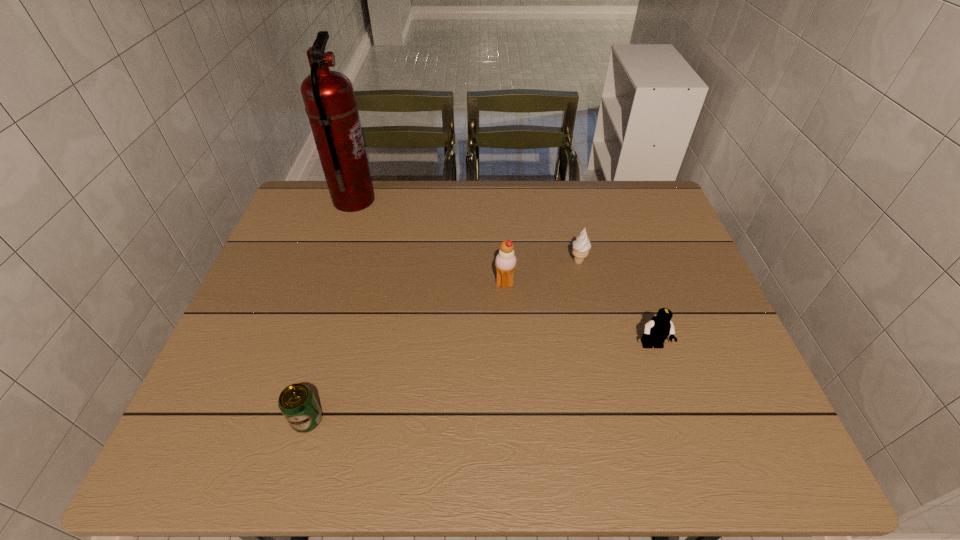
Identify the location of free space located on the nozzle side of the farthest object. This screenshot has width=960, height=540. (438, 201).

You are a GUI agent. You are given a task and a screenshot of the screen. Output one action in this format:
    pyautogui.click(x=<x>, y=<y>)
    Task: Click on the free space located at the front with a straw on the nearer icecream
    This screenshot has height=540, width=960.
    Given the screenshot: What is the action you would take?
    pyautogui.click(x=475, y=285)

Image resolution: width=960 pixels, height=540 pixels. What are the coordinates of `free spot located 0.280m at the front with a straw on the nearer icecream` in the screenshot? It's located at (388, 285).

Where is `vacant space located at the front with a straw on the nearer icecream`? The height and width of the screenshot is (540, 960). vacant space located at the front with a straw on the nearer icecream is located at coordinates tap(419, 285).

Locate an element on the screen. Image resolution: width=960 pixels, height=540 pixels. vacant region located 0.080m on the front-facing side of the shorter icecream is located at coordinates (585, 290).

What are the coordinates of `vacant space located 0.120m on the front-facing side of the rightmost object` in the screenshot? It's located at (671, 402).

Where is `free point located 0.380m on the back of the beer can`? Image resolution: width=960 pixels, height=540 pixels. free point located 0.380m on the back of the beer can is located at coordinates click(x=348, y=275).

What are the coordinates of `object that is at the far edge` in the screenshot? It's located at (328, 96).

The height and width of the screenshot is (540, 960). In order to click on object present at the near edge in this screenshot , I will do `click(297, 402)`.

What are the coordinates of `object that is at the left edge` in the screenshot? It's located at (328, 96).